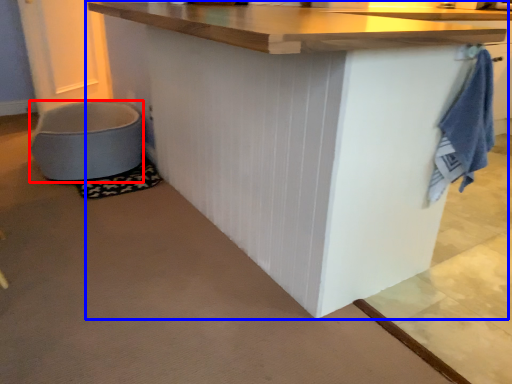
Question: Which point is closer to the camera, toilet bowl (highlighted by a red box) or table (highlighted by a blue box)?

Choices:
 (A) toilet bowl
 (B) table

Answer: (B)